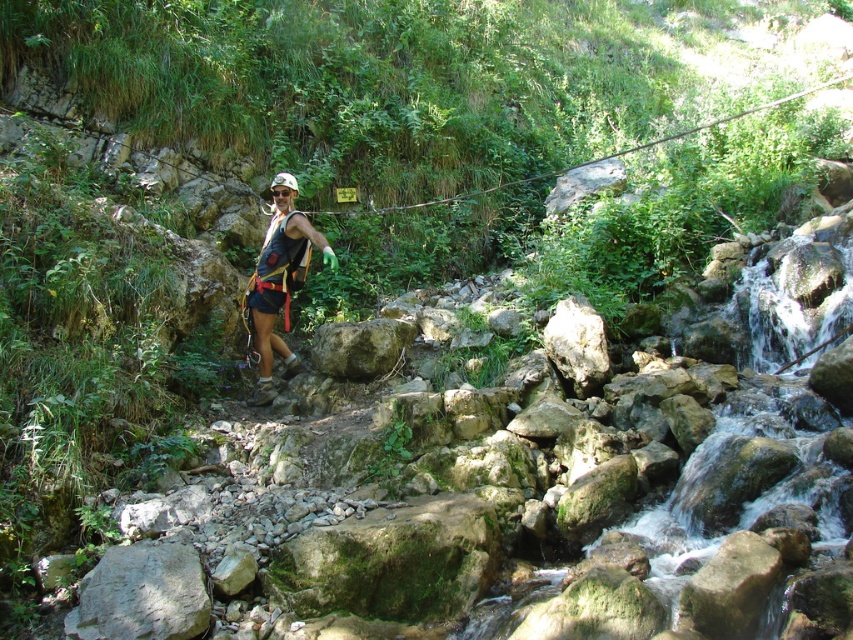
Does matte black vest at center have a larger size compared to green mossy rock at center?

Yes.

Is matte black vest at center smaller than green mossy rock at center?

Incorrect, matte black vest at center is not smaller in size than green mossy rock at center.

Where is `matte black vest at center`? matte black vest at center is located at coordinates (280, 280).